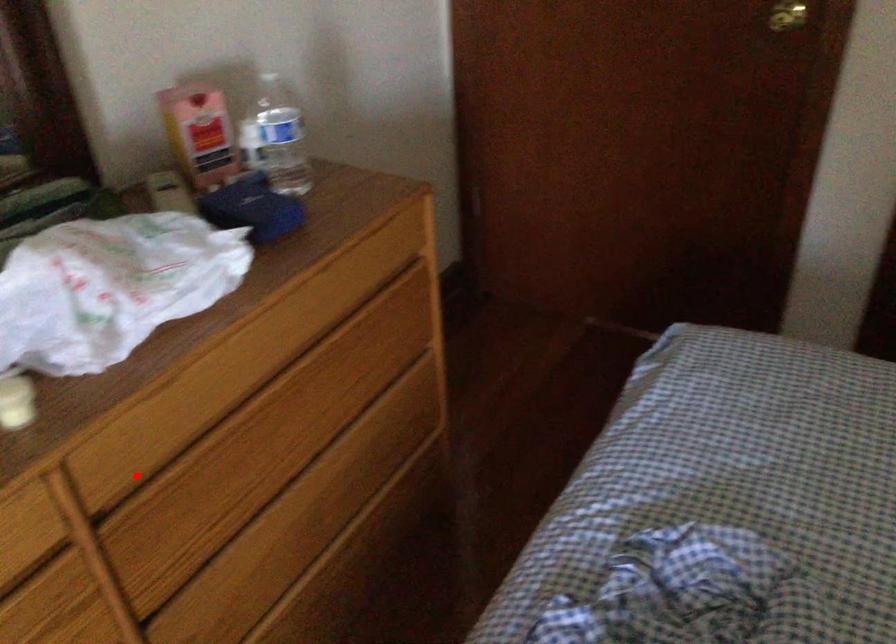
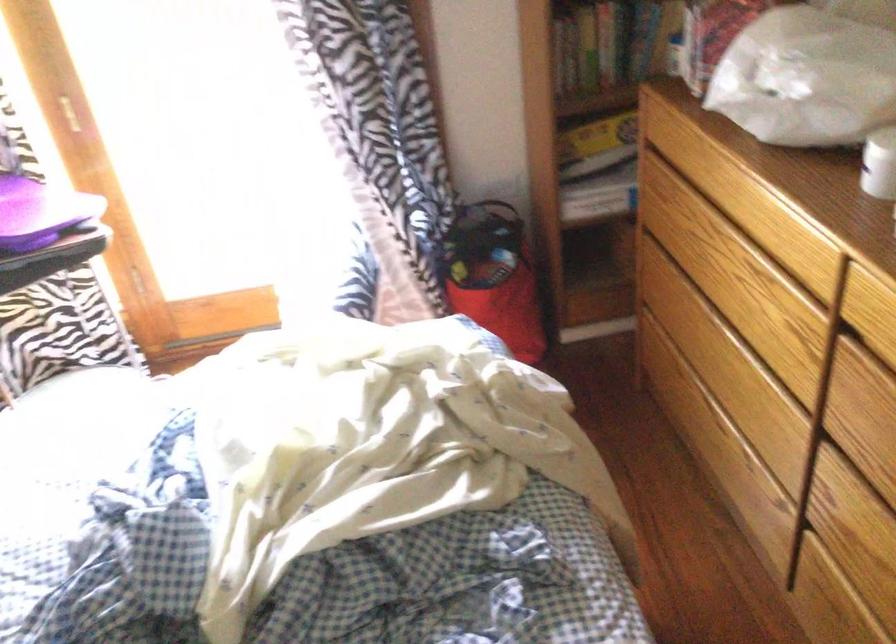
In the second image, find the point that corresponds to the highlighted location in the first image.

(874, 339)